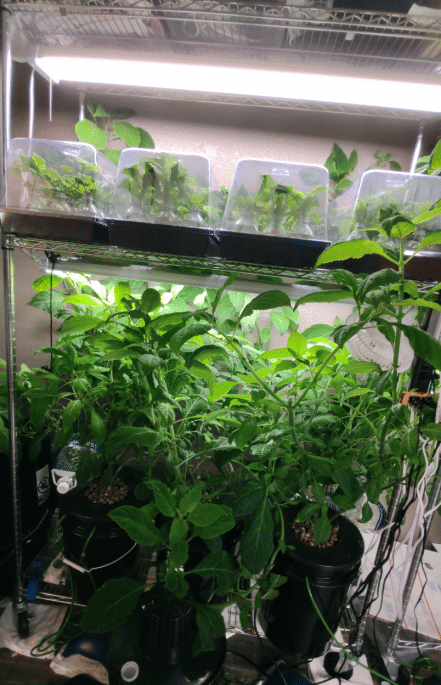
Find the location of `plant`. plant is located at coordinates (181, 525).